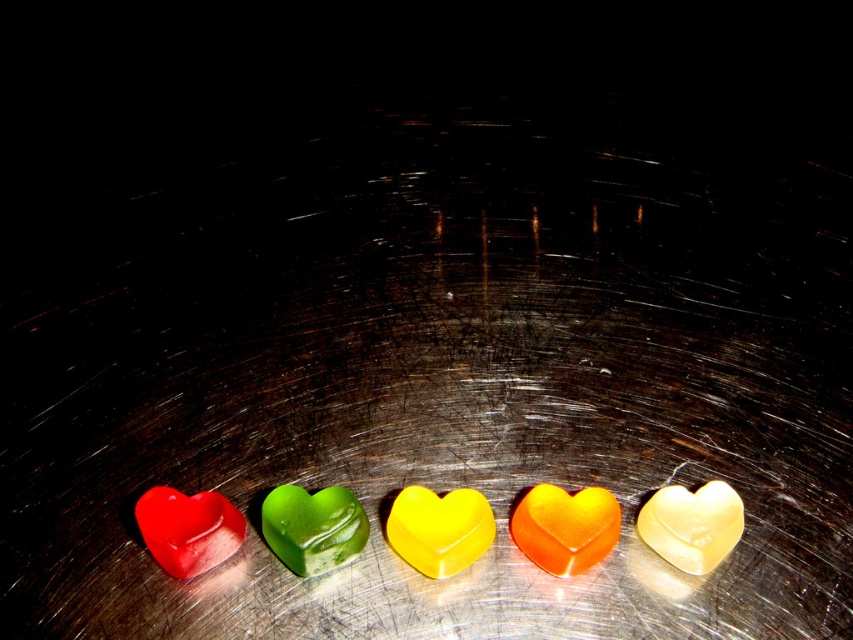
Question: Is translucent orange heart at center above yellow translucent heart at center?

Choices:
 (A) yes
 (B) no

Answer: (A)

Question: Which point is farther to the camera?

Choices:
 (A) matte translucent heart at left
 (B) green translucent heart at center
 (C) translucent yellow heart at center

Answer: (B)

Question: Is translucent orange heart at center further to camera compared to translucent yellow heart at center?

Choices:
 (A) no
 (B) yes

Answer: (B)

Question: Can you confirm if translucent orange heart at center is wider than translucent yellow heart at center?

Choices:
 (A) yes
 (B) no

Answer: (A)

Question: Among these points, which one is farthest from the camera?

Choices:
 (A) (440, 497)
 (B) (209, 525)
 (C) (701, 504)
 (D) (577, 500)

Answer: (A)

Question: Among these points, which one is farthest from the camera?

Choices:
 (A) (538, 515)
 (B) (723, 525)
 (C) (361, 536)

Answer: (C)